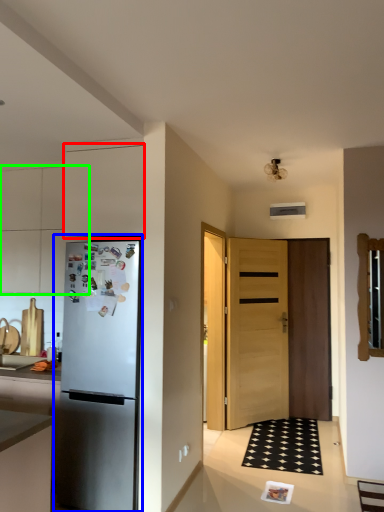
Question: Based on their relative distances, which object is farther from cabinetry (highlighted by a red box)? Choose from refrigerator (highlighted by a blue box) and cabinetry (highlighted by a green box).

Choices:
 (A) refrigerator
 (B) cabinetry

Answer: (B)